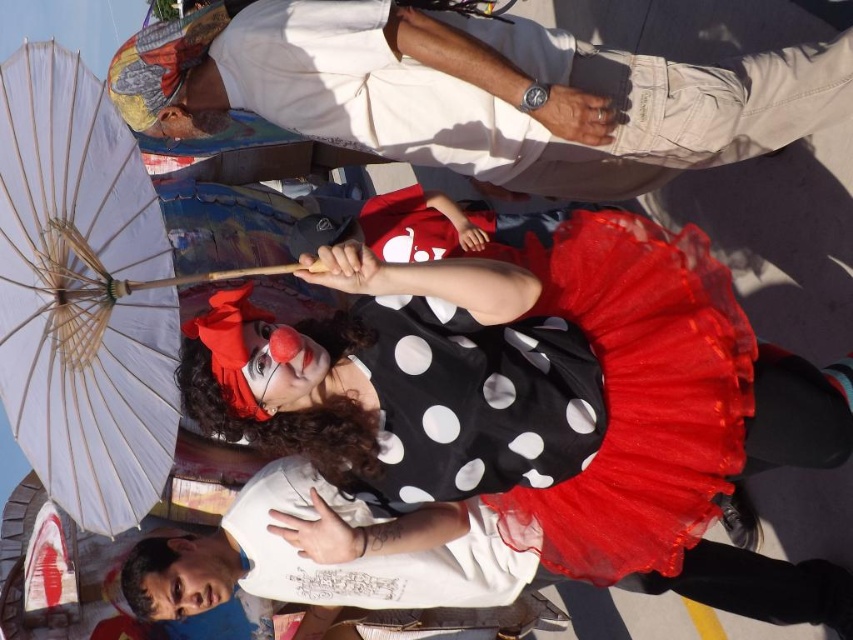
Question: Is white cotton shirt at upper center smaller than black polka dot tulle dress at center?

Choices:
 (A) no
 (B) yes

Answer: (A)

Question: Among these points, which one is farthest from the camera?

Choices:
 (A) coord(20,355)
 (B) coord(457,106)

Answer: (B)

Question: Is white cotton shirt at upper center smaller than white paper umbrella at left?

Choices:
 (A) yes
 (B) no

Answer: (B)

Question: Based on their relative distances, which object is farther from the white cotton shirt at upper center?

Choices:
 (A) white paper umbrella at left
 (B) black polka dot tulle dress at center

Answer: (A)

Question: Among these points, which one is nearest to the camera?

Choices:
 (A) (637, 365)
 (B) (33, 404)
 (C) (468, 48)

Answer: (B)

Question: Does white cotton shirt at upper center appear on the left side of white paper umbrella at left?

Choices:
 (A) yes
 (B) no

Answer: (B)